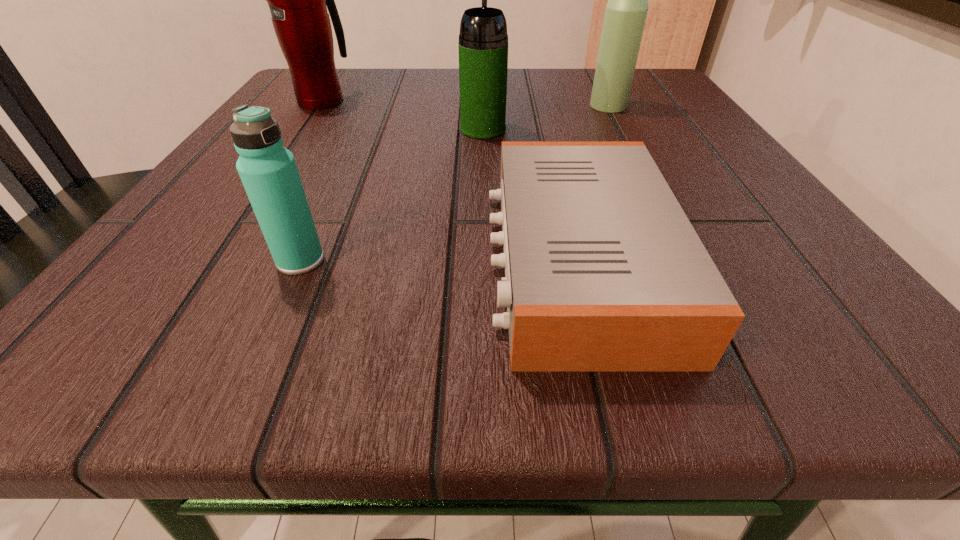
Where is `the rightmost thermos bottle`? the rightmost thermos bottle is located at coordinates (625, 15).

This screenshot has width=960, height=540. I want to click on the leftmost object, so click(297, 0).

At what (x,y) coordinates should I click in order to perform the action: click on the third farthest object. Please return your answer as a coordinate pair (x, y). This screenshot has width=960, height=540. Looking at the image, I should click on click(x=483, y=40).

Locate an element on the screen. This screenshot has width=960, height=540. the second thermos bottle from right to left is located at coordinates (483, 40).

At what (x,y) coordinates should I click in order to perform the action: click on the shortest thermos bottle. Please return your answer as a coordinate pair (x, y). Looking at the image, I should click on (268, 171).

Where is `the nearest thermos bottle`? the nearest thermos bottle is located at coordinates (268, 171).

What are the coordinates of `the shortest object` in the screenshot? It's located at (603, 270).

In order to click on free space located on the left of the rightmost thermos bottle in this screenshot , I will do `click(501, 106)`.

At what (x,y) coordinates should I click in order to perform the action: click on free point located on the side with the handle of the leftmost thermos bottle. Please return your answer as a coordinate pair (x, y). The width and height of the screenshot is (960, 540). Looking at the image, I should click on (338, 79).

I want to click on vacant area located from the spout of the second nearest thermos bottle, so click(x=483, y=89).